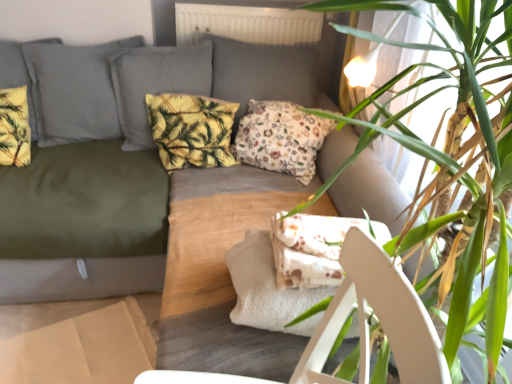
Question: Is floral fabric pillow at center, the 1th pillow positioned from the right, at the left side of green leafy plant at upper right?

Choices:
 (A) no
 (B) yes

Answer: (B)

Question: Considering the relative sizes of floral fabric pillow at center, the 1th pillow positioned from the right, and green leafy plant at upper right in the image provided, is floral fabric pillow at center, the 1th pillow positioned from the right, taller than green leafy plant at upper right?

Choices:
 (A) no
 (B) yes

Answer: (A)

Question: Would you say floral fabric pillow at center, the 1th pillow positioned from the right, is outside green leafy plant at upper right?

Choices:
 (A) yes
 (B) no

Answer: (A)

Question: Are floral fabric pillow at center, acting as the third pillow starting from the left, and green leafy plant at upper right located far from each other?

Choices:
 (A) no
 (B) yes

Answer: (A)

Question: Is floral fabric pillow at center, acting as the third pillow starting from the left, in contact with green leafy plant at upper right?

Choices:
 (A) yes
 (B) no

Answer: (B)

Question: From a real-world perspective, is yellow floral fabric pillow at upper left, marked as the 3th pillow in a right-to-left arrangement, physically located above or below floral fabric pillow at center, acting as the third pillow starting from the left?

Choices:
 (A) above
 (B) below

Answer: (A)

Question: Considering the positions of yellow floral fabric pillow at upper left, marked as the 3th pillow in a right-to-left arrangement, and floral fabric pillow at center, acting as the third pillow starting from the left, in the image, is yellow floral fabric pillow at upper left, marked as the 3th pillow in a right-to-left arrangement, wider or thinner than floral fabric pillow at center, acting as the third pillow starting from the left,?

Choices:
 (A) wide
 (B) thin

Answer: (B)

Question: Is point (20, 165) closer or farther from the camera than point (323, 135)?

Choices:
 (A) closer
 (B) farther

Answer: (A)

Question: From the image's perspective, is yellow floral fabric pillow at upper left, which appears as the 1th pillow when viewed from the left, above or below floral fabric pillow at center, the 1th pillow positioned from the right?

Choices:
 (A) above
 (B) below

Answer: (A)

Question: From a real-world perspective, is floral fabric pillow at center, acting as the third pillow starting from the left, positioned above or below yellow floral fabric pillow at upper left, marked as the 3th pillow in a right-to-left arrangement?

Choices:
 (A) above
 (B) below

Answer: (B)

Question: From the image's perspective, is floral fabric pillow at center, the 1th pillow positioned from the right, above or below yellow floral fabric pillow at upper left, marked as the 3th pillow in a right-to-left arrangement?

Choices:
 (A) above
 (B) below

Answer: (B)

Question: Relative to yellow floral fabric pillow at upper left, which appears as the 1th pillow when viewed from the left, is floral fabric pillow at center, the 1th pillow positioned from the right, in front or behind?

Choices:
 (A) behind
 (B) front

Answer: (A)

Question: In terms of size, does floral fabric pillow at center, acting as the third pillow starting from the left, appear bigger or smaller than yellow floral fabric pillow at upper left, marked as the 3th pillow in a right-to-left arrangement?

Choices:
 (A) big
 (B) small

Answer: (A)

Question: From a real-world perspective, is white fabric armchair at center above or below white cardboard box at lower left?

Choices:
 (A) below
 (B) above

Answer: (B)

Question: From the image's perspective, is white fabric armchair at center located above or below white cardboard box at lower left?

Choices:
 (A) above
 (B) below

Answer: (A)